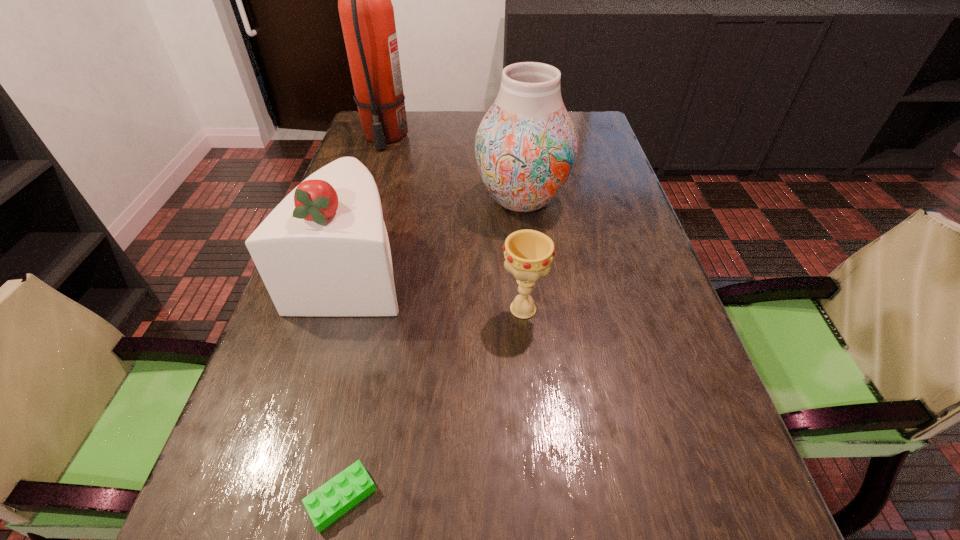
Identify the location of free point located 0.350m on the back of the chalice. (513, 199).

Image resolution: width=960 pixels, height=540 pixels. I want to click on vacant region located 0.330m on the right of the Lego, so click(x=597, y=497).

Identify the location of object that is at the far edge. (366, 12).

At what (x,y) coordinates should I click in order to perform the action: click on fire extinguisher at the left edge. Please return your answer as a coordinate pair (x, y). This screenshot has width=960, height=540. Looking at the image, I should click on (366, 12).

Where is `cake positioned at the left edge`? The width and height of the screenshot is (960, 540). cake positioned at the left edge is located at coordinates (324, 251).

Find the location of a particular element. Image resolution: width=960 pixels, height=540 pixels. Lego located at the left edge is located at coordinates [x=330, y=501].

Locate an element on the screen. The height and width of the screenshot is (540, 960). object located in the far left corner section of the desktop is located at coordinates (366, 12).

Identify the location of vacant space at the far edge. (469, 117).

Image resolution: width=960 pixels, height=540 pixels. I want to click on vacant space at the right edge of the desktop, so click(628, 386).

You are a GUI agent. You are given a task and a screenshot of the screen. Output one action in this format:
    pyautogui.click(x=<x>, y=<y>)
    Task: Click on the vacant space at the far right corner of the desktop
    Image resolution: width=960 pixels, height=540 pixels.
    Given the screenshot: What is the action you would take?
    pyautogui.click(x=586, y=128)